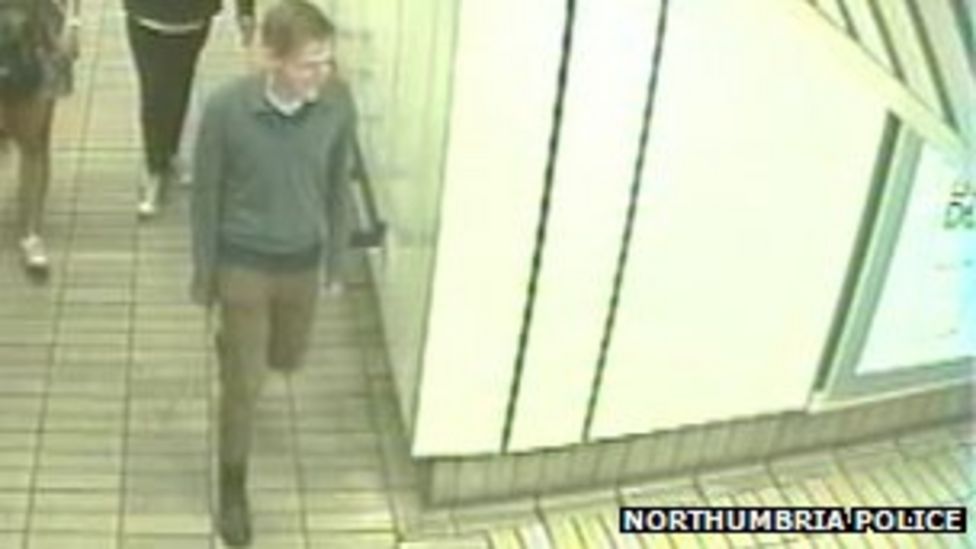
Where is `wall`? wall is located at coordinates (414, 74), (701, 116).